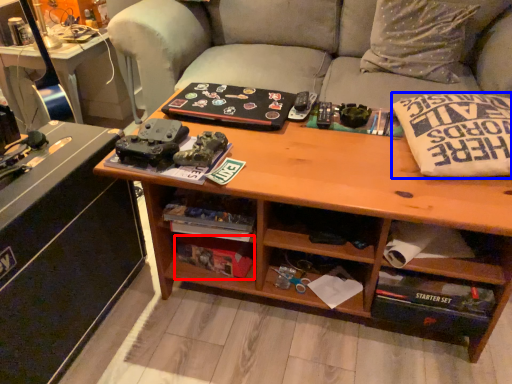
Question: Which object is closer to the camera taking this photo, book (highlighted by a red box) or pillow (highlighted by a blue box)?

Choices:
 (A) book
 (B) pillow

Answer: (B)